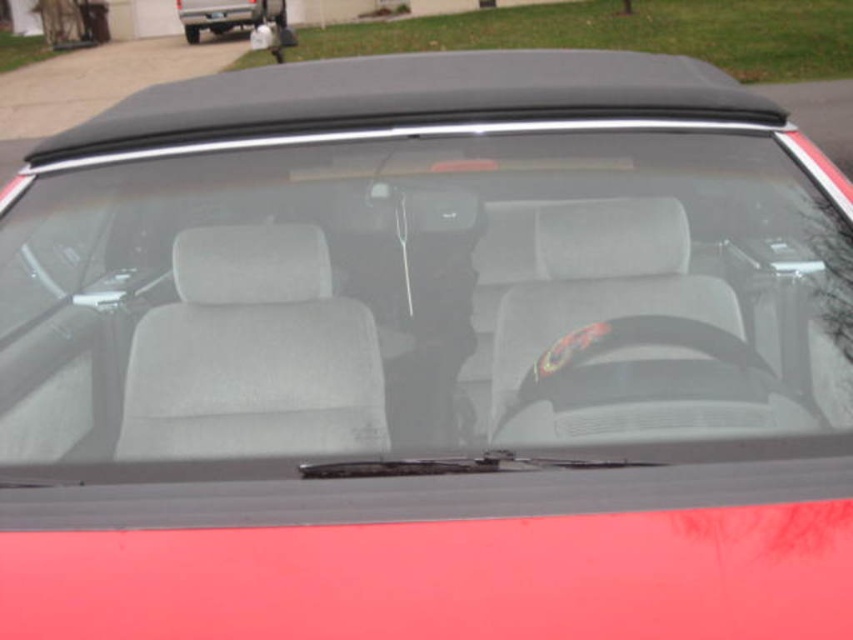
Which is below, matte black convertible at upper center or black plastic license plate at center?

matte black convertible at upper center is below.

Does point (245, 16) come closer to viewer compared to point (219, 17)?

Yes, point (245, 16) is in front of point (219, 17).

The width and height of the screenshot is (853, 640). What are the coordinates of `matte black convertible at upper center` in the screenshot? It's located at (227, 13).

Is gray fabric seat at center in front of black plastic license plate at center?

That is True.

Does gray fabric seat at center have a lesser width compared to black plastic license plate at center?

In fact, gray fabric seat at center might be wider than black plastic license plate at center.

Image resolution: width=853 pixels, height=640 pixels. Describe the element at coordinates (253, 353) in the screenshot. I see `gray fabric seat at center` at that location.

Where is `gray fabric seat at center`? This screenshot has height=640, width=853. gray fabric seat at center is located at coordinates (253, 353).

Between gray fabric seat at center and matte black convertible at upper center, which one has more height?

With more height is matte black convertible at upper center.

Which is behind, point (177, 301) or point (253, 10)?

The point (253, 10) is behind.

Where is `gray fabric seat at center`? This screenshot has width=853, height=640. gray fabric seat at center is located at coordinates (253, 353).